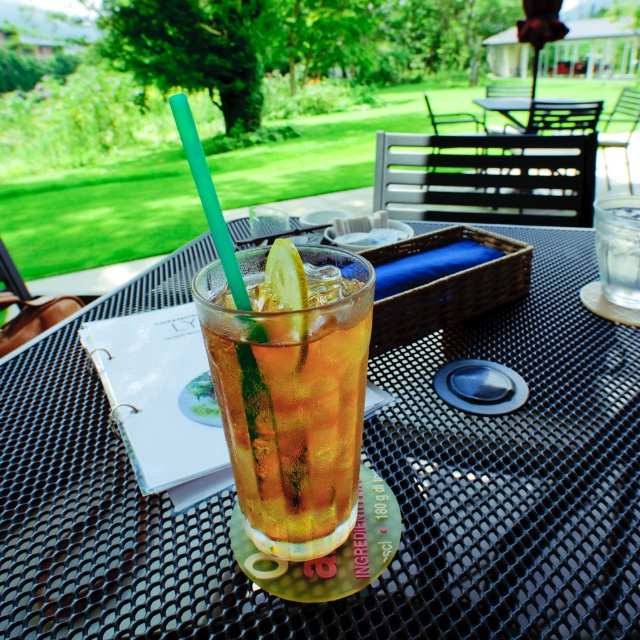
Question: Can you confirm if translucent glass at center is wider than black metal table at center?

Choices:
 (A) no
 (B) yes

Answer: (A)

Question: Which of the following is the farthest from the observer?

Choices:
 (A) (x=273, y=276)
 (B) (x=547, y=276)
 (C) (x=582, y=112)
 (D) (x=268, y=464)

Answer: (C)

Question: Does translucent glass at center appear on the left side of green translucent lemon at center?

Choices:
 (A) no
 (B) yes

Answer: (A)

Question: Among these points, which one is farthest from the camera?

Choices:
 (A) (256, 480)
 (B) (296, 264)
 (C) (531, 99)
 (D) (99, 564)

Answer: (C)

Question: Can you confirm if green translucent lemon at center is positioned to the left of black metal table at center?

Choices:
 (A) no
 (B) yes

Answer: (B)

Question: Which object is the farthest from the black mesh table at center?

Choices:
 (A) black metal table at center
 (B) translucent glass at center

Answer: (A)